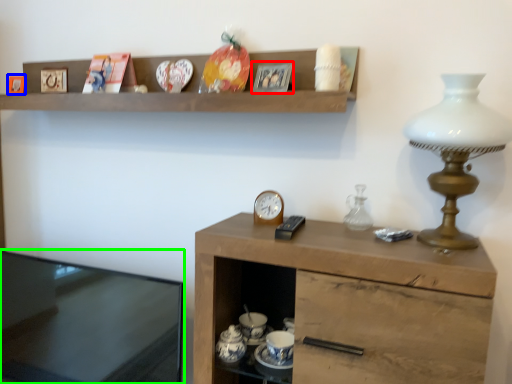
Question: Which object is the farthest from picture frame (highlighted by a red box)? Choose among these: picture frame (highlighted by a blue box) or desk (highlighted by a green box).

Choices:
 (A) picture frame
 (B) desk

Answer: (B)